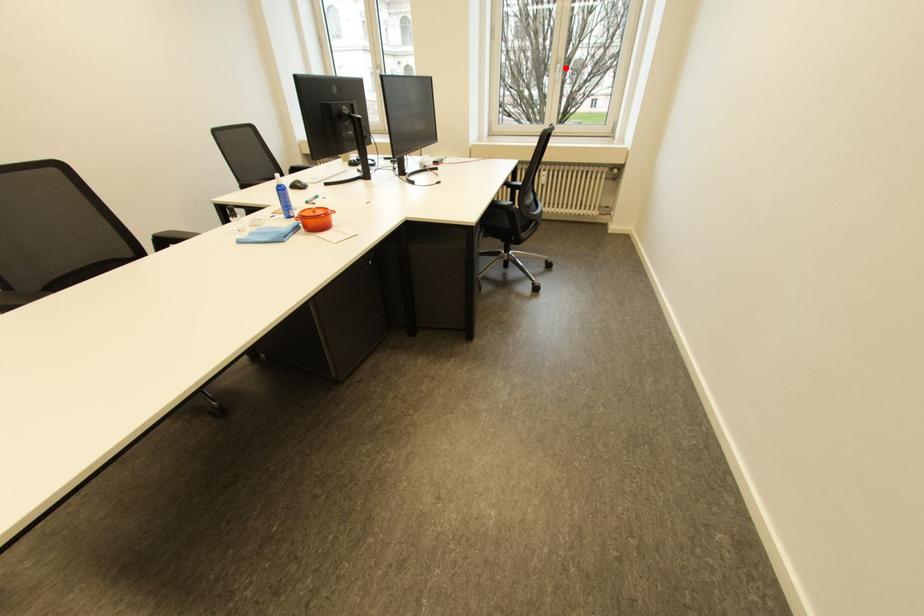
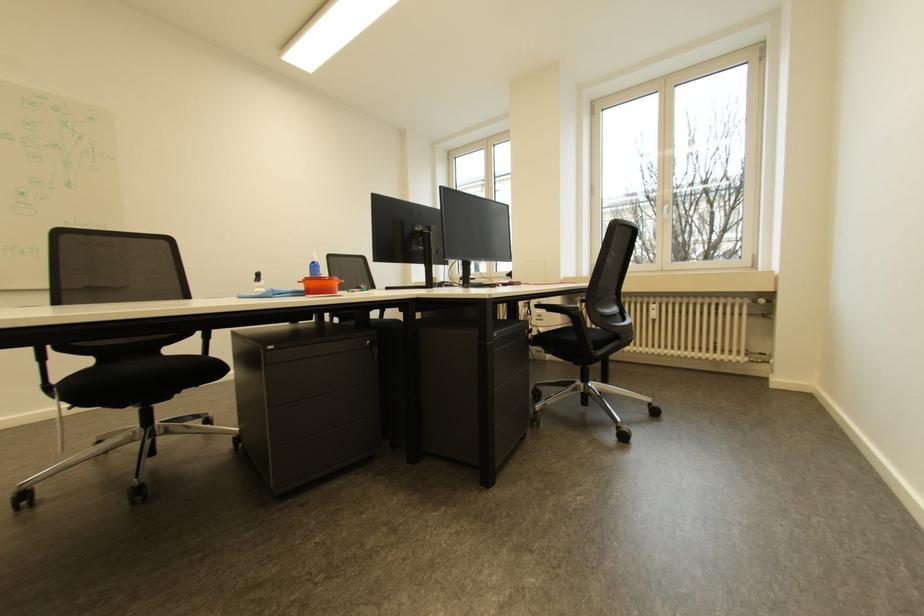
Where in the second image is the point corresponding to the highlighted location from the first image?

(672, 209)